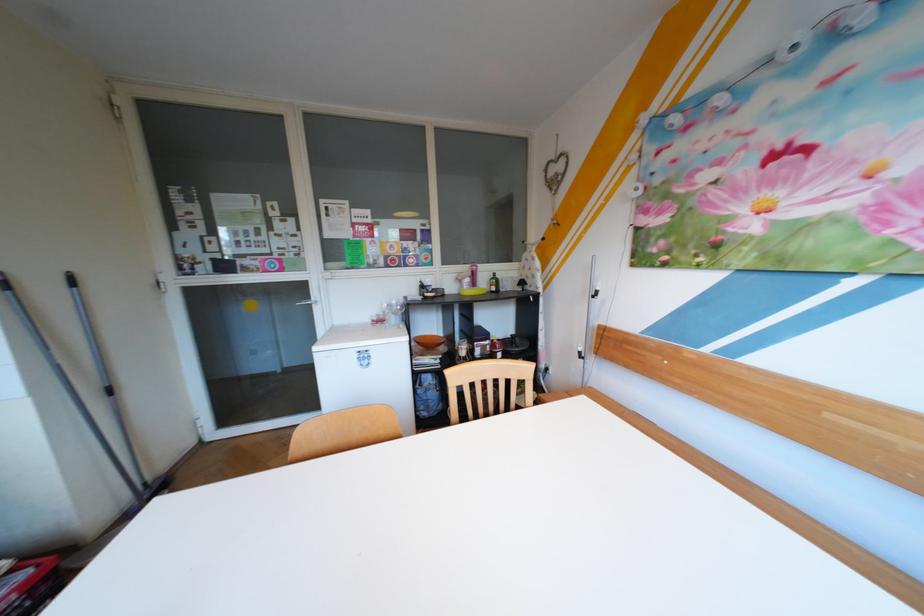
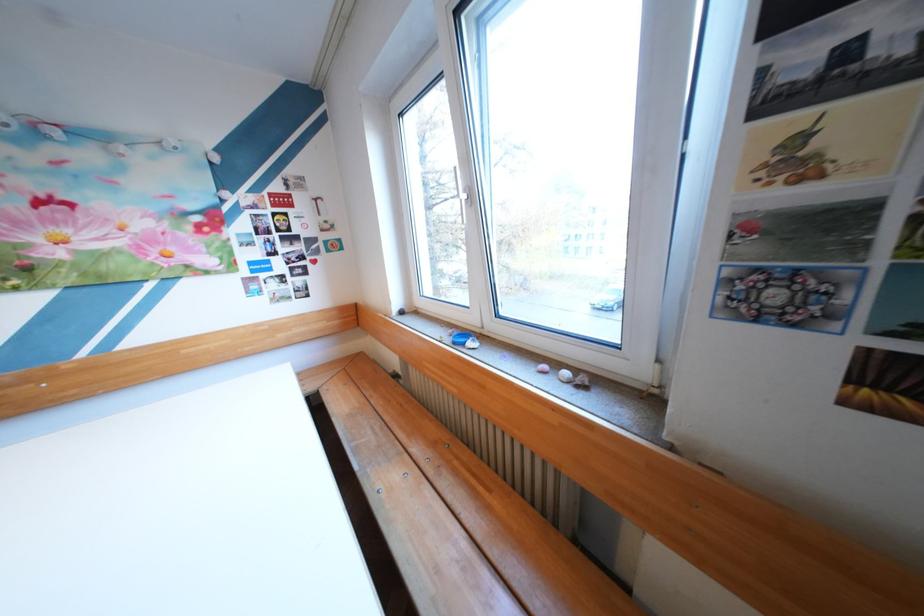
How did the camera likely rotate?

The camera's rotation is toward right-down.